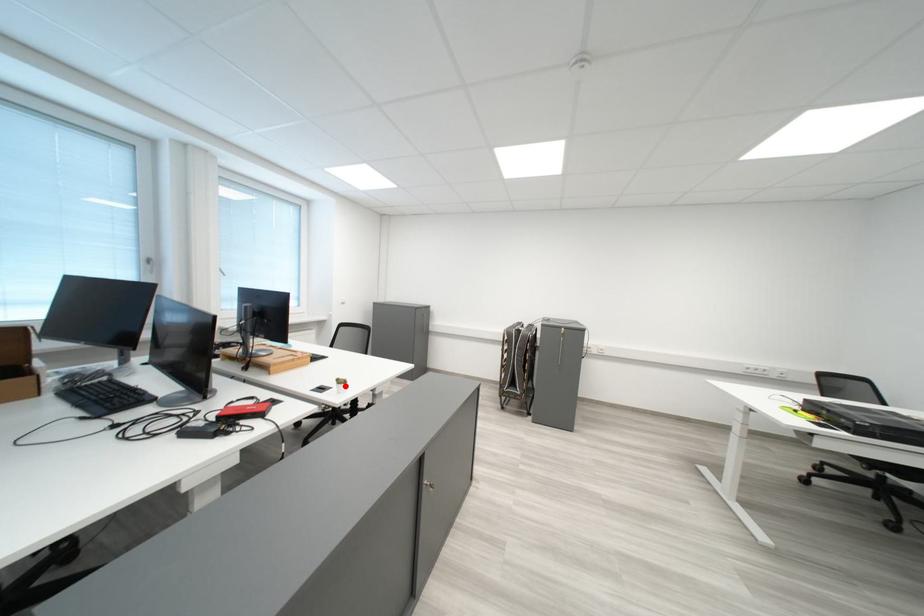
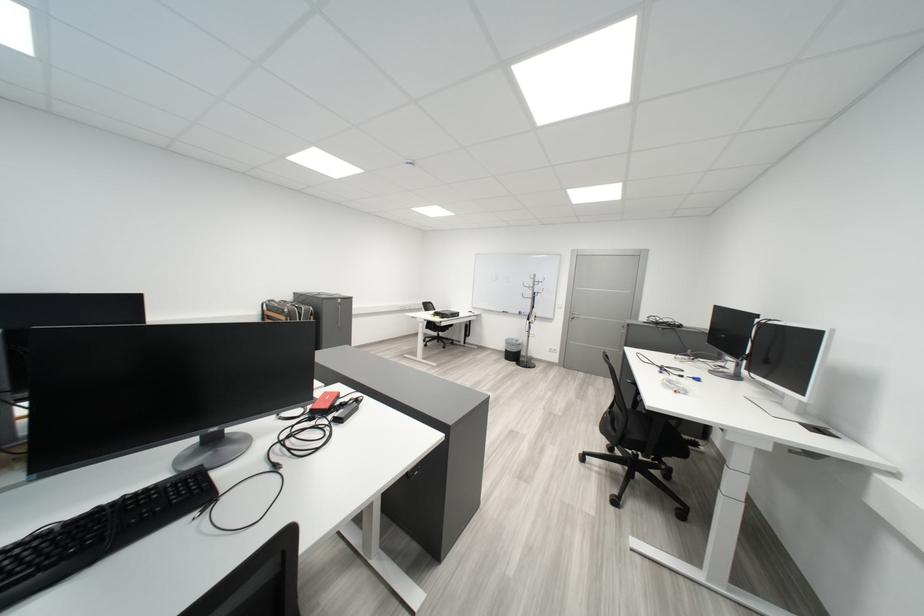
Question: I am providing you with two images of the same scene from different viewpoints. A red point is marked on the first image. Is the red point's position out of view in image 2?

Choices:
 (A) Yes
 (B) No

Answer: (A)